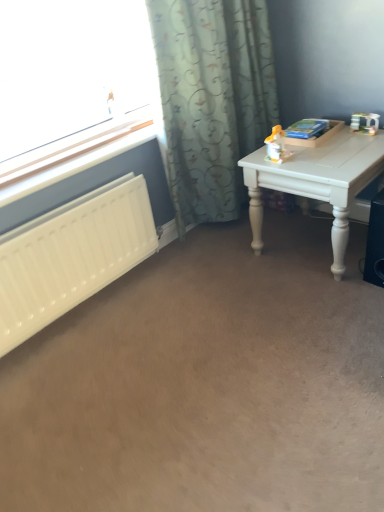
What do you see at coordinates (71, 256) in the screenshot? This screenshot has height=512, width=384. I see `white matte radiator at left` at bounding box center [71, 256].

In order to face white plastic radiator at left, should I rotate leftwards or rightwards?

You should look left and rotate roughly 13.777 degrees.

The width and height of the screenshot is (384, 512). Describe the element at coordinates (212, 99) in the screenshot. I see `patterned fabric curtain at upper center` at that location.

This screenshot has height=512, width=384. I want to click on white matte radiator at left, so click(x=71, y=256).

From the image's perspective, is white painted wood table at right above yellow plastic toy at upper right?

No, from the image's perspective, white painted wood table at right is not over yellow plastic toy at upper right.

What are the coordinates of `toy behind the white painted wood table at right` in the screenshot? It's located at (277, 145).

From a real-world perspective, which is physically below, white painted wood table at right or yellow plastic toy at upper right?

white painted wood table at right, from a real-world perspective.

Is white painted wood table at right not near yellow plastic toy at upper right?

No, white painted wood table at right is in close proximity to yellow plastic toy at upper right.

From a real-world perspective, is white painted wood table at right positioned under white plastic radiator at left based on gravity?

Yes, from a real-world perspective, white painted wood table at right is below white plastic radiator at left.

Is there a large distance between white painted wood table at right and white plastic radiator at left?

They are positioned close to each other.

Between white matte radiator at left and patterned fabric curtain at upper center, which one has smaller width?

white matte radiator at left.

Is white matte radiator at left further to the viewer compared to patterned fabric curtain at upper center?

No, white matte radiator at left is in front of patterned fabric curtain at upper center.

Is white matte radiator at left oriented away from patterned fabric curtain at upper center?

No, white matte radiator at left is not facing away from patterned fabric curtain at upper center.

Which is correct: white matte radiator at left is inside patterned fabric curtain at upper center, or outside of it?

white matte radiator at left is spatially situated outside patterned fabric curtain at upper center.

Is yellow plastic toy at upper right turned away from patterned fabric curtain at upper center?

No, yellow plastic toy at upper right's orientation is not away from patterned fabric curtain at upper center.

Are yellow plastic toy at upper right and patterned fabric curtain at upper center far apart?

No.

Considering the sizes of yellow plastic toy at upper right and patterned fabric curtain at upper center in the image, is yellow plastic toy at upper right wider or thinner than patterned fabric curtain at upper center?

In the image, yellow plastic toy at upper right appears to be more narrow than patterned fabric curtain at upper center.

Considering the sizes of objects white plastic radiator at left and yellow plastic toy at upper right in the image provided, who is shorter, white plastic radiator at left or yellow plastic toy at upper right?

With less height is white plastic radiator at left.

From the image's perspective, does white plastic radiator at left appear lower than yellow plastic toy at upper right?

Correct, white plastic radiator at left appears lower than yellow plastic toy at upper right in the image.

Considering the relative sizes of white plastic radiator at left and yellow plastic toy at upper right in the image provided, is white plastic radiator at left wider than yellow plastic toy at upper right?

Yes.

Visually, is white plastic radiator at left positioned to the left or to the right of yellow plastic toy at upper right?

white plastic radiator at left is positioned on yellow plastic toy at upper right's left side.

Based on the photo, from their relative heights in the image, would you say white matte radiator at left is taller or shorter than white painted wood table at right?

white matte radiator at left is shorter than white painted wood table at right.

Does white matte radiator at left turn towards white painted wood table at right?

No, white matte radiator at left is not turned towards white painted wood table at right.

Is white matte radiator at left in front of white painted wood table at right?

Yes, it is in front of white painted wood table at right.

Which object is positioned more to the left, white matte radiator at left or white painted wood table at right?

From the viewer's perspective, white matte radiator at left appears more on the left side.

Is patterned fabric curtain at upper center to the right of yellow plastic toy at upper right from the viewer's perspective?

Incorrect, patterned fabric curtain at upper center is not on the right side of yellow plastic toy at upper right.

Considering the points (273, 74) and (268, 146), which point is behind, point (273, 74) or point (268, 146)?

The point (273, 74) is farther from the camera.

Considering the relative sizes of patterned fabric curtain at upper center and yellow plastic toy at upper right in the image provided, is patterned fabric curtain at upper center taller than yellow plastic toy at upper right?

Yes.

Is patterned fabric curtain at upper center oriented towards yellow plastic toy at upper right?

Yes.

Where is `table beneath the yellow plastic toy at upper right (from a real-world perspective)`? table beneath the yellow plastic toy at upper right (from a real-world perspective) is located at coordinates (317, 181).

At what (x,y) coordinates should I click in order to perform the action: click on window sill on the left of white painted wood table at right. Please return your answer as a coordinate pair (x, y). Looking at the image, I should click on (69, 153).

Considering their positions, is white painted wood table at right positioned further to yellow plastic toy at upper right than patterned fabric curtain at upper center?

patterned fabric curtain at upper center is positioned further to the anchor yellow plastic toy at upper right.

Estimate the real-world distances between objects in this image. Which object is closer to white plastic radiator at left, white matte radiator at left or patterned fabric curtain at upper center?

The object closer to white plastic radiator at left is white matte radiator at left.

Estimate the real-world distances between objects in this image. Which object is closer to white plastic radiator at left, yellow plastic toy at upper right or patterned fabric curtain at upper center?

The object closer to white plastic radiator at left is patterned fabric curtain at upper center.

From the image, which object appears to be farther from white plastic radiator at left, patterned fabric curtain at upper center or yellow plastic toy at upper right?

Among the two, yellow plastic toy at upper right is located further to white plastic radiator at left.

When comparing their distances from patterned fabric curtain at upper center, does white painted wood table at right or white matte radiator at left seem closer?

white painted wood table at right.

When comparing their distances from yellow plastic toy at upper right, does patterned fabric curtain at upper center or white painted wood table at right seem further?

patterned fabric curtain at upper center.

Considering their positions, is patterned fabric curtain at upper center positioned further to white painted wood table at right than white plastic radiator at left?

white plastic radiator at left is further to white painted wood table at right.

Looking at the image, which one is located further to white painted wood table at right, white matte radiator at left or patterned fabric curtain at upper center?

white matte radiator at left is further to white painted wood table at right.

Locate an element on the screen. The width and height of the screenshot is (384, 512). curtain located between white matte radiator at left and black plastic speaker at lower right in the left-right direction is located at coordinates (212, 99).

Identify the location of curtain between white matte radiator at left and white painted wood table at right from left to right. (212, 99).

At what (x,y) coordinates should I click in order to perform the action: click on window sill between white matte radiator at left and white painted wood table at right. Please return your answer as a coordinate pair (x, y). The width and height of the screenshot is (384, 512). Looking at the image, I should click on (69, 153).

I want to click on toy between white matte radiator at left and black plastic speaker at lower right in the horizontal direction, so click(277, 145).